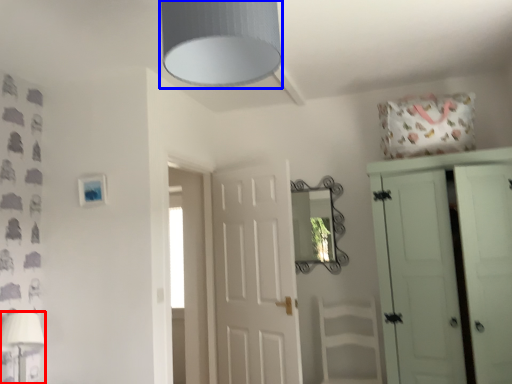
Question: Which object appears farthest to the camera in this image, table lamp (highlighted by a red box) or light fixture (highlighted by a blue box)?

Choices:
 (A) table lamp
 (B) light fixture

Answer: (A)